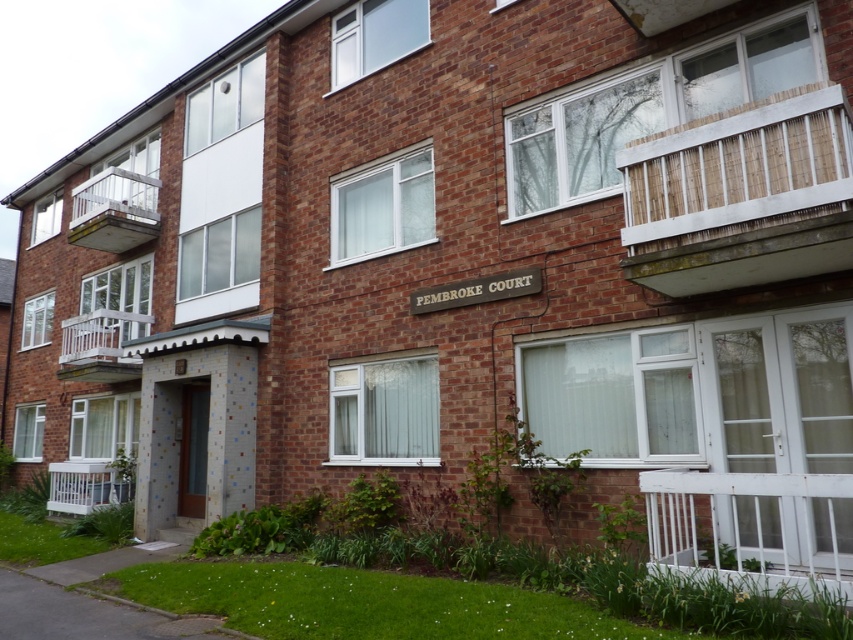
Does point (711, 545) come behind point (77, 364)?

No, it is in front of (77, 364).

Does point (811, 474) lie in front of point (136, 365)?

Yes, point (811, 474) is in front of point (136, 365).

Where is `white wooden balcony at lower right`? white wooden balcony at lower right is located at coordinates (752, 525).

Does white bamboo balcony at upper right have a lesser width compared to white wooden balcony at lower right?

No, white bamboo balcony at upper right is not thinner than white wooden balcony at lower right.

Who is higher up, white bamboo balcony at upper right or white wooden balcony at lower right?

Positioned higher is white bamboo balcony at upper right.

What do you see at coordinates (741, 196) in the screenshot? The image size is (853, 640). I see `white bamboo balcony at upper right` at bounding box center [741, 196].

The image size is (853, 640). Identify the location of white bamboo balcony at upper right. (741, 196).

Can you confirm if wooden white balcony at left is positioned to the right of white plastic balcony at lower left?

Correct, you'll find wooden white balcony at left to the right of white plastic balcony at lower left.

Which of these two, wooden white balcony at left or white plastic balcony at lower left, stands taller?

wooden white balcony at left is taller.

What do you see at coordinates (114, 211) in the screenshot? This screenshot has width=853, height=640. I see `wooden white balcony at left` at bounding box center [114, 211].

You are a GUI agent. You are given a task and a screenshot of the screen. Output one action in this format:
    pyautogui.click(x=<x>, y=<y>)
    Task: Click on the wooden white balcony at left
    
    Given the screenshot: What is the action you would take?
    pyautogui.click(x=114, y=211)